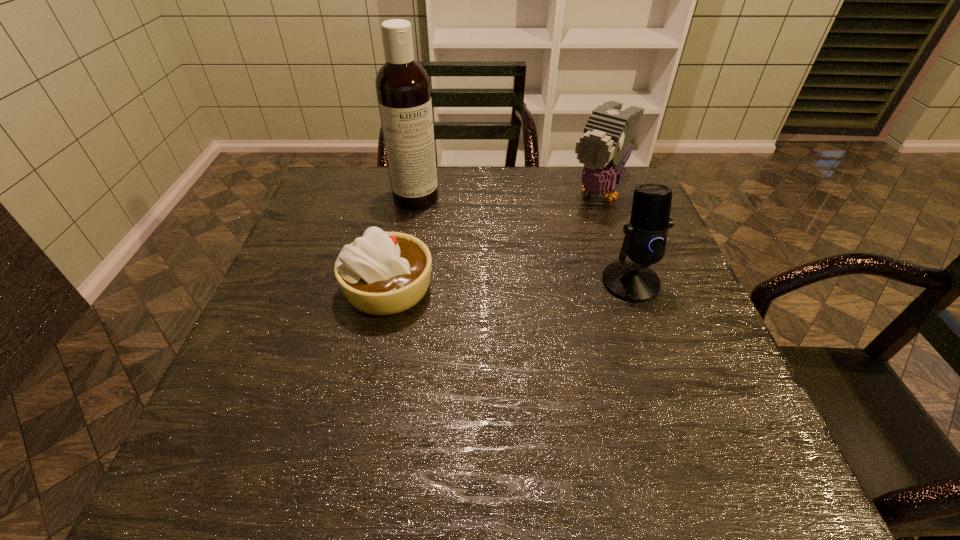
I want to click on vacant area that lies between the bird and the microphone, so click(x=614, y=238).

Identify which object is the third closest to the microphone. Please provide its 2D coordinates. Your answer should be formatted as a tuple, i.e. [(x, y)], where the tuple contains the x and y coordinates of a point satisfying the conditions above.

[(402, 85)]

Choose which object is the second nearest neighbor to the shortest object. Please provide its 2D coordinates. Your answer should be formatted as a tuple, i.e. [(x, y)], where the tuple contains the x and y coordinates of a point satisfying the conditions above.

[(604, 148)]